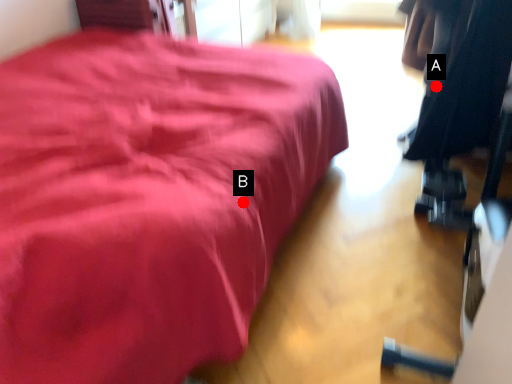
Question: Two points are circled on the image, labeled by A and B beside each circle. Which point appears closest to the camera in this image?

Choices:
 (A) A is closer
 (B) B is closer

Answer: (B)